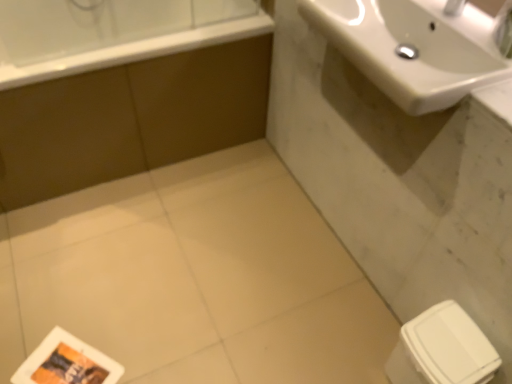
Question: In terms of size, does white glossy sink at upper right appear bigger or smaller than brown matte bathtub at upper left?

Choices:
 (A) big
 (B) small

Answer: (B)

Question: Is point (330, 0) closer or farther from the camera than point (147, 155)?

Choices:
 (A) closer
 (B) farther

Answer: (A)

Question: Estimate the real-world distances between objects in this image. Which object is farther from the brown matte bathtub at upper left?

Choices:
 (A) white glossy bathtub at upper left
 (B) white glossy sink at upper right

Answer: (B)

Question: Which object is the closest to the brown matte bathtub at upper left?

Choices:
 (A) white glossy sink at upper right
 (B) white glossy bathtub at upper left

Answer: (B)